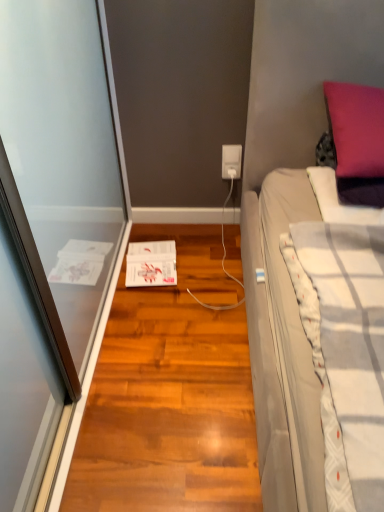
Question: From the image's perspective, is white plastic power outlet at center located beneath shiny brown hardwood floor at center?

Choices:
 (A) no
 (B) yes

Answer: (A)

Question: Does white plastic power outlet at center appear on the left side of shiny brown hardwood floor at center?

Choices:
 (A) yes
 (B) no

Answer: (B)

Question: Does white plastic power outlet at center have a larger size compared to shiny brown hardwood floor at center?

Choices:
 (A) no
 (B) yes

Answer: (A)

Question: From a real-world perspective, does white plastic power outlet at center sit lower than shiny brown hardwood floor at center?

Choices:
 (A) no
 (B) yes

Answer: (A)

Question: Is white plastic power outlet at center further to the viewer compared to shiny brown hardwood floor at center?

Choices:
 (A) no
 (B) yes

Answer: (B)

Question: Is purple velvet pillow at upper right inside the boundaries of white plastic power outlet at center, or outside?

Choices:
 (A) inside
 (B) outside

Answer: (B)

Question: Based on their positions, is purple velvet pillow at upper right located to the left or right of white plastic power outlet at center?

Choices:
 (A) left
 (B) right

Answer: (B)

Question: From a real-world perspective, is purple velvet pillow at upper right positioned above or below white plastic power outlet at center?

Choices:
 (A) above
 (B) below

Answer: (A)

Question: From the image's perspective, relative to white plastic power outlet at center, is purple velvet pillow at upper right above or below?

Choices:
 (A) above
 (B) below

Answer: (A)

Question: Is point (236, 152) closer or farther from the camera than point (380, 150)?

Choices:
 (A) closer
 (B) farther

Answer: (B)

Question: Relative to purple velvet pillow at upper right, is white plastic power outlet at center in front or behind?

Choices:
 (A) behind
 (B) front

Answer: (A)

Question: From a real-world perspective, is white plastic power outlet at center physically located above or below purple velvet pillow at upper right?

Choices:
 (A) above
 (B) below

Answer: (B)

Question: Is white plastic power outlet at center wider or thinner than purple velvet pillow at upper right?

Choices:
 (A) wide
 (B) thin

Answer: (B)

Question: Considering the positions of white plastic power outlet at center and shiny brown hardwood floor at center in the image, is white plastic power outlet at center taller or shorter than shiny brown hardwood floor at center?

Choices:
 (A) tall
 (B) short

Answer: (A)

Question: Do you think white plastic power outlet at center is within shiny brown hardwood floor at center, or outside of it?

Choices:
 (A) inside
 (B) outside

Answer: (B)